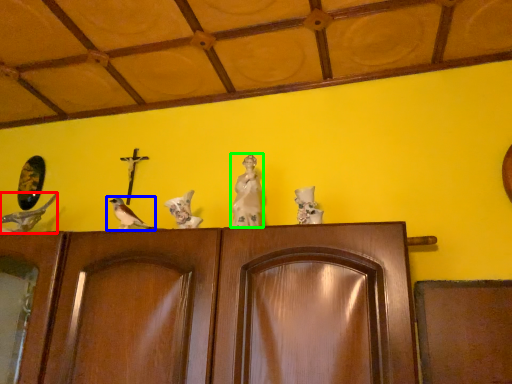
Question: Considering the real-world distances, which object is farthest from bird (highlighted by a red box)? bird (highlighted by a blue box) or sculpture (highlighted by a green box)?

Choices:
 (A) bird
 (B) sculpture

Answer: (B)